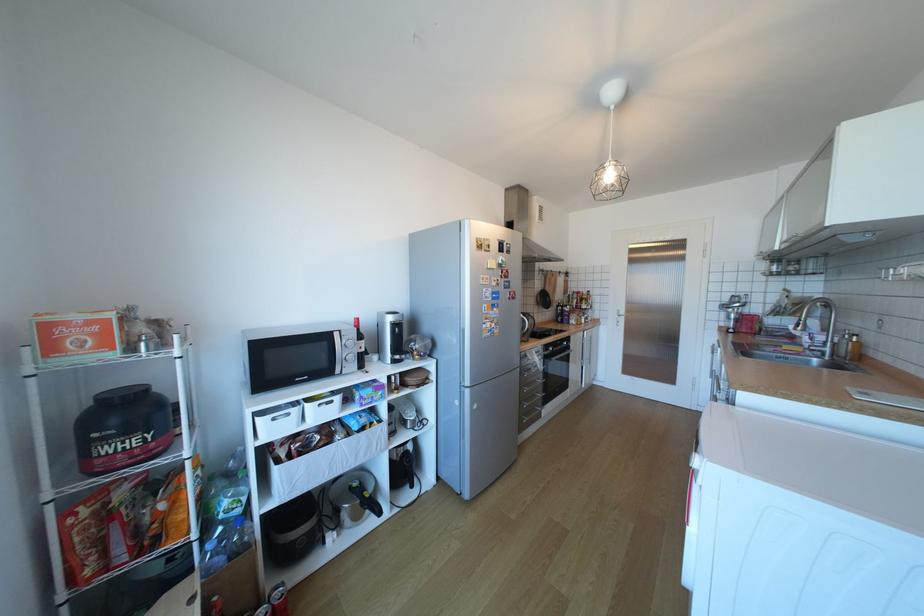
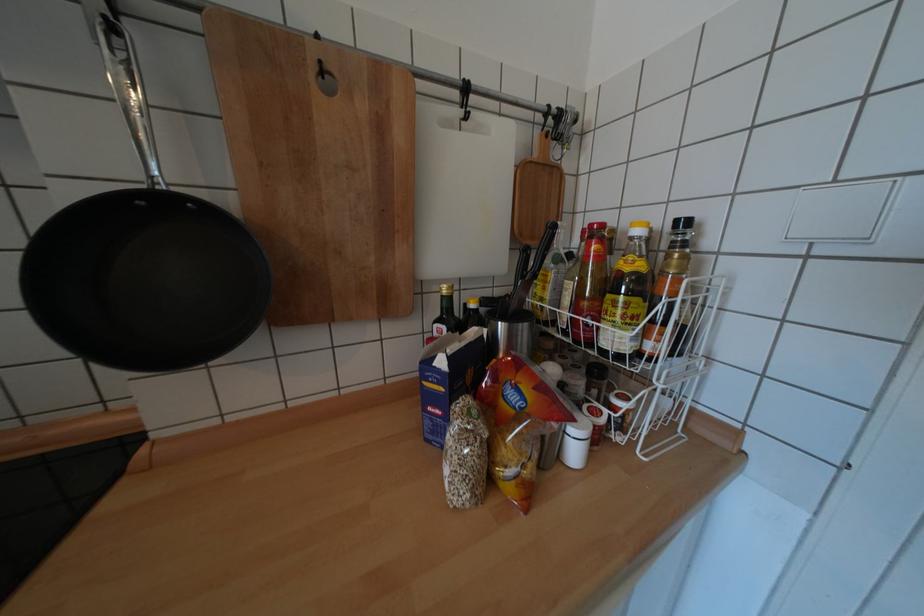
In a continuous first-person perspective shot, in which direction is the camera moving?

The movement direction of the cameraman is right, forward.